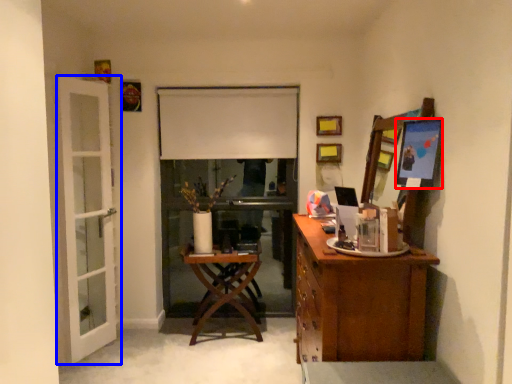
Question: Which point is closer to the camera, picture frame (highlighted by a red box) or door (highlighted by a blue box)?

Choices:
 (A) picture frame
 (B) door

Answer: (A)